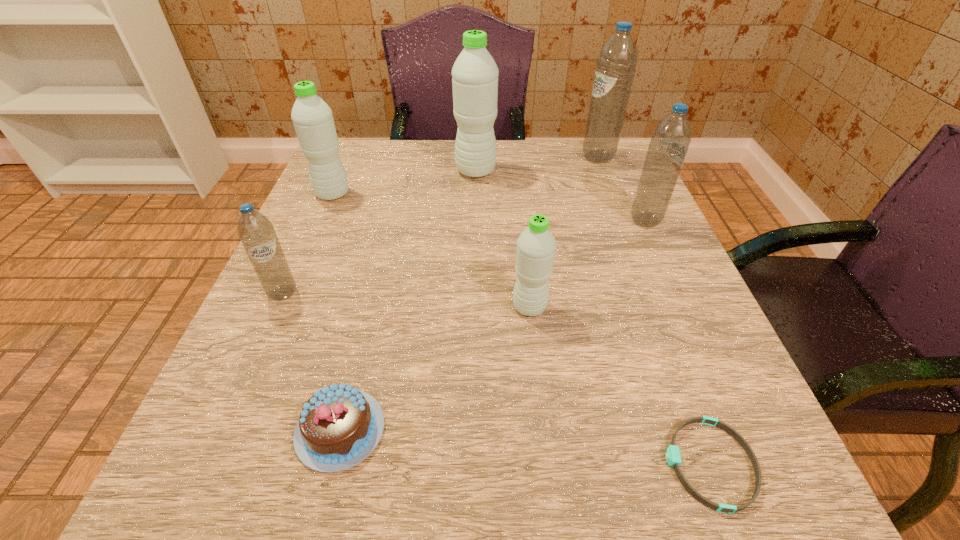
Identify the location of the nearest blue water bottle. (257, 234).

You are a GUI agent. You are given a task and a screenshot of the screen. Output one action in this format:
    pyautogui.click(x=<x>, y=<y>)
    Task: Click on the pink chocolate cake
    
    Given the screenshot: What is the action you would take?
    pyautogui.click(x=339, y=426)

Locate an element on the screen. The width and height of the screenshot is (960, 540). the seventh tallest object is located at coordinates (339, 426).

Where is `wristband`? The image size is (960, 540). wristband is located at coordinates (673, 457).

Where is `gray wristband`? The height and width of the screenshot is (540, 960). gray wristband is located at coordinates (673, 457).

The image size is (960, 540). What are the coordinates of `blank space located 0.210m on the right of the fourth object from left to right` in the screenshot? It's located at 585,171.

Identify the location of free location located on the front of the farthest blue water bottle. The height and width of the screenshot is (540, 960). (633, 247).

Identify the location of vacant space situated 0.120m on the right of the second farthest green water bottle. (405, 194).

Locate an element on the screen. vacant space located on the back of the second smallest blue water bottle is located at coordinates (621, 167).

You are a GUI agent. You are given a task and a screenshot of the screen. Output one action in this format:
    pyautogui.click(x=<x>, y=<y>)
    Task: Click on the free space located on the back of the nearest green water bottle
    The height and width of the screenshot is (540, 960).
    Given the screenshot: What is the action you would take?
    pyautogui.click(x=518, y=206)